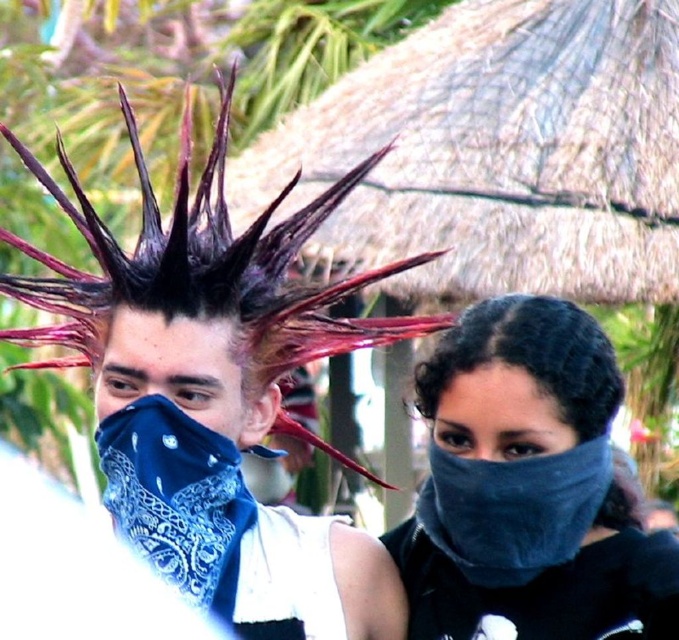
You are a photographer at a festival and need to capture both the shiny dark hair at center and the dark curly hair at center in a single frame. Since your camera has a limited focus range, which hair style should you prioritize to ensure it appears clearer in the photo?

The shiny dark hair at center is bigger than dark curly hair at center, so you should prioritize focusing on the shiny dark hair at center to ensure it appears clearer in the photo.

You are standing in front of two people at a festival. You notice two points marked on the image, one at point coordinates point (x=210, y=566) and the other at point coordinates point (x=485, y=314). Which point is closer to you?

Point (x=210, y=566) is further to the camera than point (x=485, y=314), so the point closer to you is point (x=485, y=314).